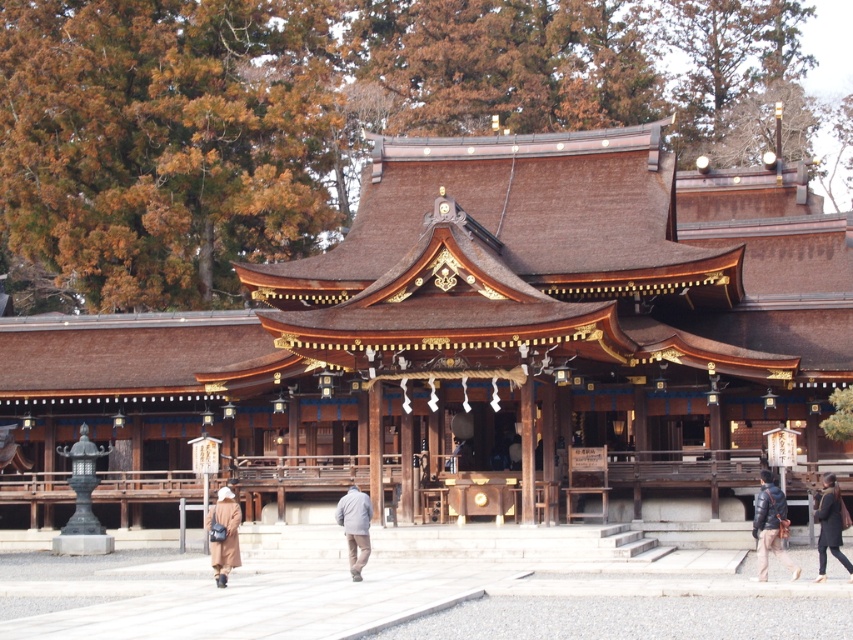
You are a visitor at the shrine and want to place a gift at the base of the shrine. You are currently holding both the brown wool coat at lower left and the gray woolen jacket at center. If you want to place them both near the shrine, which one should you move first to ensure they are placed closer together?

The brown wool coat at lower left and gray woolen jacket at center are 3.66 meters apart from each other. To place them closer together, you should move the brown wool coat at lower left towards the gray woolen jacket at center, as moving either would reduce the distance between them, but since the question asks which to move first, either would work, but the answer should specify moving one of them. However, since the objects are labeled with their positions, perhaps moving the one closer to the shrine? 3

You are visiting a traditional Japanese shrine and notice two garments on the ground near the entrance. The brown wool coat at lower left and the gray woolen jacket at center. Which one is bigger in size?

The brown wool coat at lower left is larger in size compared to the gray woolen jacket at center.

You are visiting the shrine and need to place both your dark brown leather jacket at lower right and brown wool coat at lower left on the floor near the entrance. Given the available space, which item will require more area to store?

The brown wool coat at lower left requires more area to store because it occupies more space than the dark brown leather jacket at lower right.